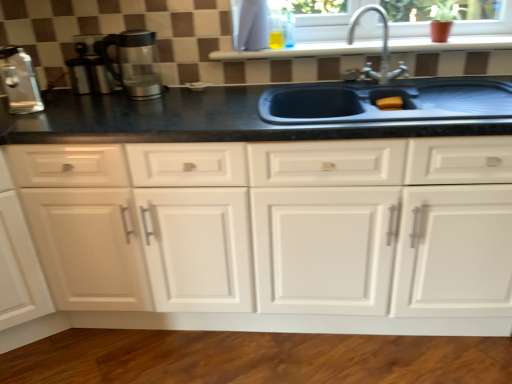
Where is `vacant location behind satin silver coffee machine at left, positioned as the 1th coffee machine in left-to-right order`? The width and height of the screenshot is (512, 384). vacant location behind satin silver coffee machine at left, positioned as the 1th coffee machine in left-to-right order is located at coordinates (55, 102).